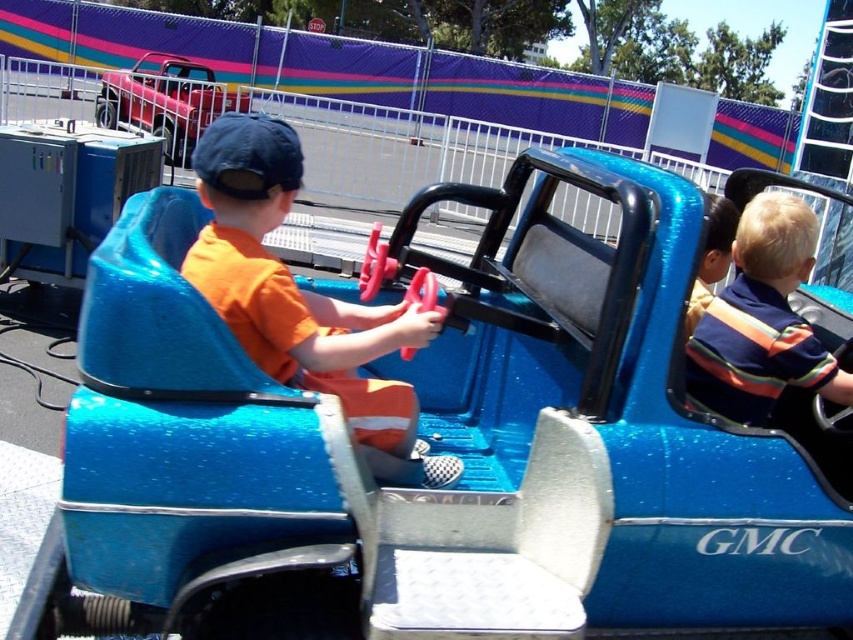
Question: Estimate the real-world distances between objects in this image. Which object is farther from the metallic pink car at upper left?

Choices:
 (A) striped cotton shirt at center
 (B) striped shirt at center
 (C) orange fabric shirt at center

Answer: (B)

Question: Is orange fabric shirt at center above metallic pink car at upper left?

Choices:
 (A) yes
 (B) no

Answer: (B)

Question: Is striped cotton shirt at center positioned at the back of metallic pink car at upper left?

Choices:
 (A) yes
 (B) no

Answer: (B)

Question: Which point is closer to the camera?

Choices:
 (A) metallic pink car at upper left
 (B) orange fabric shirt at center

Answer: (B)

Question: Which point is closer to the camera?

Choices:
 (A) orange fabric shirt at center
 (B) striped shirt at center
 (C) metallic pink car at upper left

Answer: (A)

Question: Is striped cotton shirt at center above metallic pink car at upper left?

Choices:
 (A) yes
 (B) no

Answer: (B)